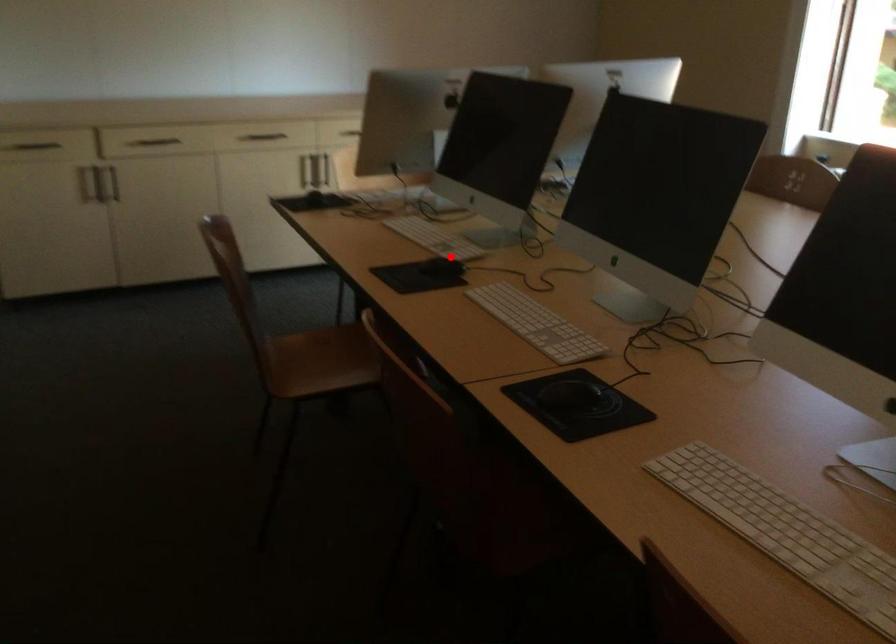
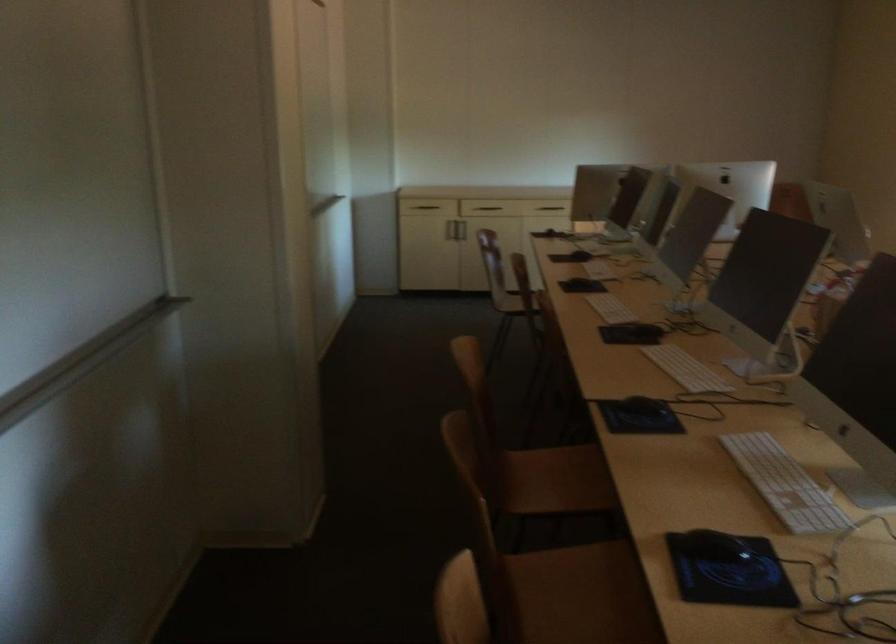
Question: I am providing you with two images of the same scene from different viewpoints. Given a red point in image1, look at the same physical point in image2. Is it:

Choices:
 (A) Closer to the viewpoint
 (B) Farther from the viewpoint

Answer: (B)